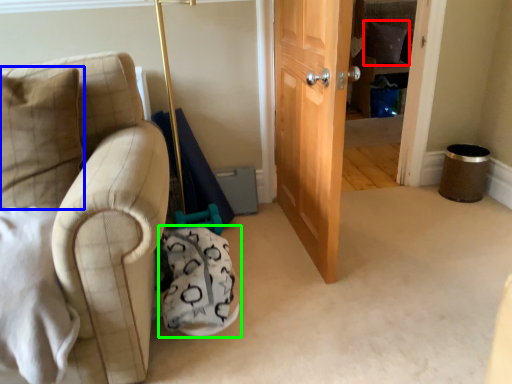
Question: Which object is the farthest from pillow (highlighted by a red box)? Choose among these: pillow (highlighted by a blue box) or swivel chair (highlighted by a green box).

Choices:
 (A) pillow
 (B) swivel chair

Answer: (A)